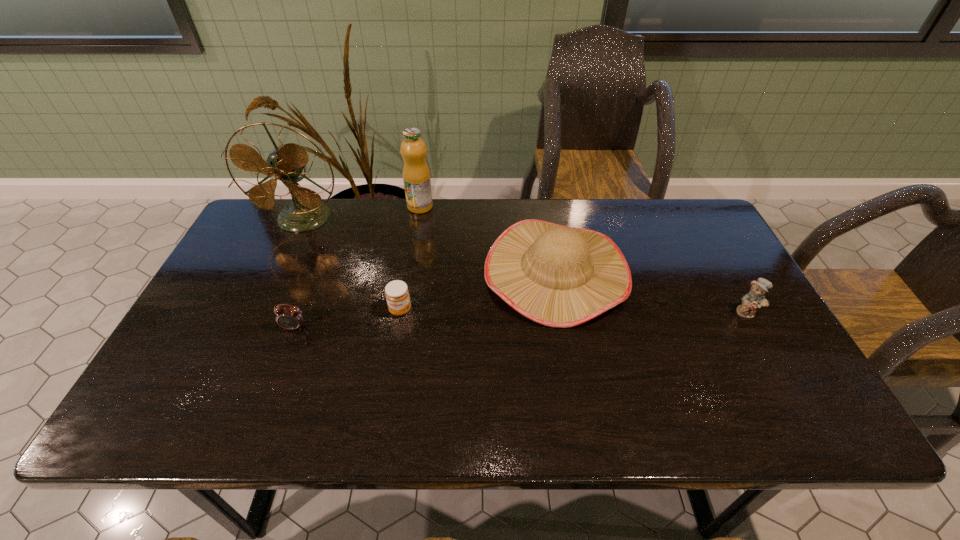
The width and height of the screenshot is (960, 540). What are the coordinates of `vacant space at the far edge` in the screenshot? It's located at (563, 221).

This screenshot has width=960, height=540. In order to click on free space at the near edge of the desktop in this screenshot , I will do `click(247, 402)`.

In the image, there is a desktop. Identify the location of vacant area at the left edge. (204, 347).

You are a GUI agent. You are given a task and a screenshot of the screen. Output one action in this format:
    pyautogui.click(x=<x>, y=<y>)
    Task: Click on the blank space at the right edge of the desktop
    The image size is (960, 540).
    Given the screenshot: What is the action you would take?
    pyautogui.click(x=723, y=296)

Where is `vacant space at the far left corner of the desktop`? vacant space at the far left corner of the desktop is located at coordinates (272, 244).

Where is `vacant area at the near left corner of the desktop`? vacant area at the near left corner of the desktop is located at coordinates (206, 410).

Identify the location of vacant area at the far right corner. (683, 232).

Find the location of `free spot between the tallest object and the fourth shortest object`. free spot between the tallest object and the fourth shortest object is located at coordinates (430, 245).

Where is `vacant point located between the fruit juice and the fourth shortest object`? The image size is (960, 540). vacant point located between the fruit juice and the fourth shortest object is located at coordinates (489, 239).

You are a GUI agent. You are given a task and a screenshot of the screen. Output one action in this format:
    pyautogui.click(x=<x>, y=<y>)
    Task: Click on the blank region between the alarm clock and the rightmost object
    The width and height of the screenshot is (960, 540).
    Given the screenshot: What is the action you would take?
    pyautogui.click(x=520, y=320)